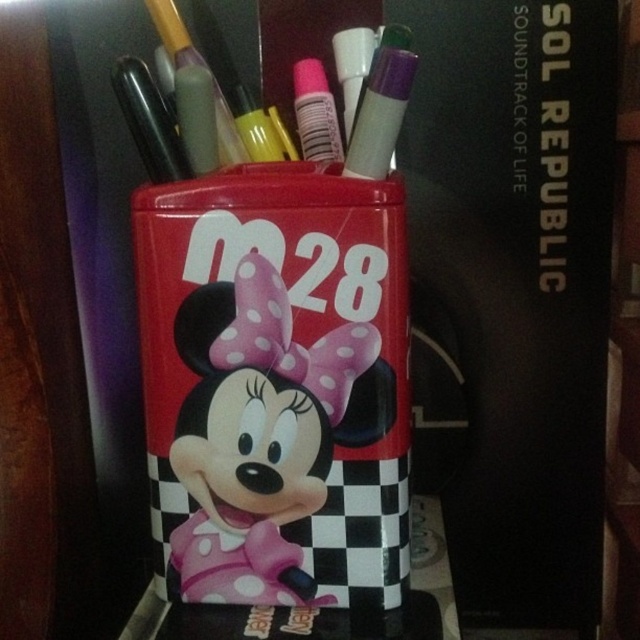
You are looking at the red pencil holder with Minnie Mouse. There are two points marked on it, one at coordinates point (x=248, y=406) and another at point (x=356, y=49). Which point is nearer to you?

Point (x=248, y=406) is closer to the camera than point (x=356, y=49).

You are organizing a desk and need to place a new marker. You have a white matte marker at upper center and a matte plastic minnie mouse at center. Which object is closer to you when looking at the desk?

The matte plastic minnie mouse at center is closer to you because it is in front of the white matte marker at upper center.